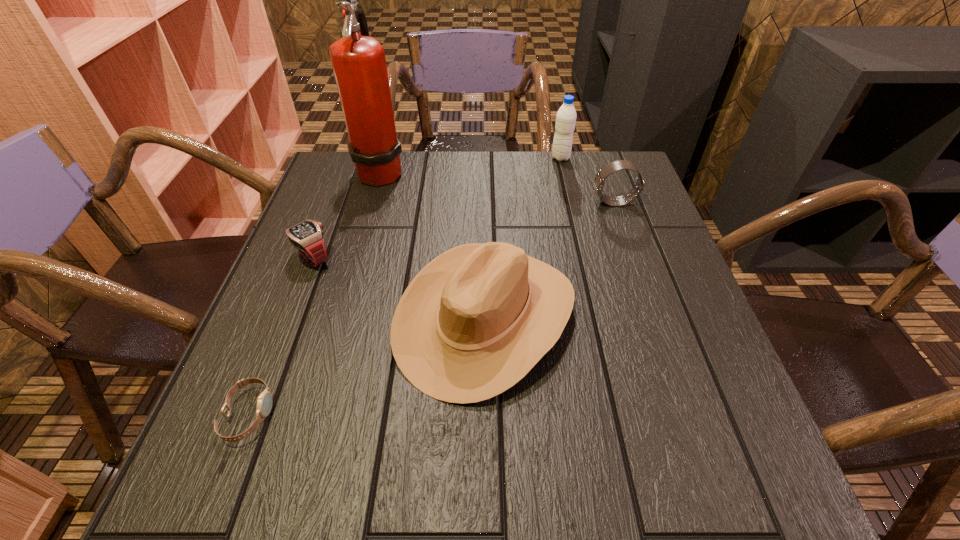
Identify the location of vacant space at the near left corner of the desktop. (259, 480).

Locate an element on the screen. This screenshot has height=540, width=960. free space at the near right corner is located at coordinates (742, 454).

Identify the location of vacant point located between the fourth shortest object and the second object from right to left. (523, 237).

You are a GUI agent. You are given a task and a screenshot of the screen. Output one action in this format:
    pyautogui.click(x=<x>, y=<y>)
    Task: Click on the free space that is in between the second nearest watch and the nearest watch
    
    Given the screenshot: What is the action you would take?
    pyautogui.click(x=281, y=336)

The height and width of the screenshot is (540, 960). In order to click on vacant area between the cowboy hat and the second tallest object in this screenshot , I will do `click(523, 237)`.

Where is `free point between the tallest object and the third object from right to left`? free point between the tallest object and the third object from right to left is located at coordinates (433, 244).

The height and width of the screenshot is (540, 960). In order to click on free space between the fire extinguisher and the shortest watch in this screenshot , I will do `click(315, 293)`.

Identify the location of vacant space in between the second tallest watch and the cowboy hat. (399, 287).

Locate an element on the screen. vacant region between the shortest watch and the fourth shortest object is located at coordinates (367, 366).

Where is `vacant region between the fourth nearest object and the tallest object`? The image size is (960, 540). vacant region between the fourth nearest object and the tallest object is located at coordinates (497, 186).